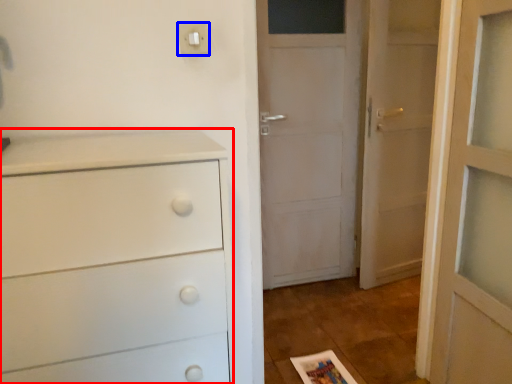
Question: Which point is closer to the camera, chest of drawers (highlighted by a red box) or light switch (highlighted by a blue box)?

Choices:
 (A) chest of drawers
 (B) light switch

Answer: (A)